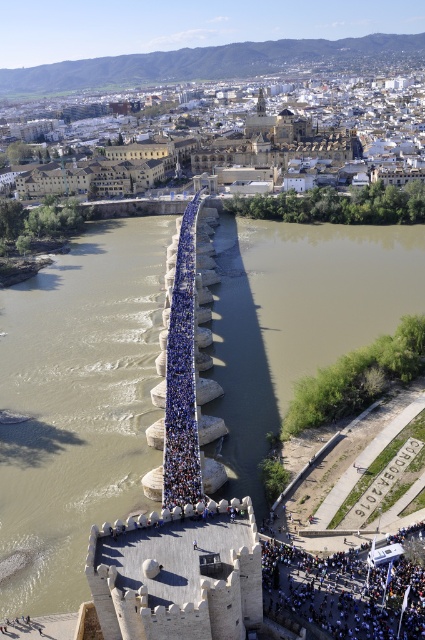
Question: Which of the following is the farthest from the observer?

Choices:
 (A) brown muddy water at center
 (B) blue fabric crowd at center
 (C) brown sedimentary stone bridge at center

Answer: (A)

Question: Can you confirm if brown muddy water at center is smaller than blue fabric crowd at center?

Choices:
 (A) no
 (B) yes

Answer: (A)

Question: Which object is positioned farthest from the brown sedimentary stone bridge at center?

Choices:
 (A) blue fabric crowd at center
 (B) brown muddy water at center

Answer: (A)

Question: Does brown sedimentary stone bridge at center appear on the right side of brown muddy water at center?

Choices:
 (A) no
 (B) yes

Answer: (A)

Question: Can you confirm if brown sedimentary stone bridge at center is positioned below brown muddy water at center?

Choices:
 (A) no
 (B) yes

Answer: (B)

Question: Which point is closer to the camera?

Choices:
 (A) brown muddy water at center
 (B) brown sedimentary stone bridge at center
 (C) blue fabric crowd at center

Answer: (C)